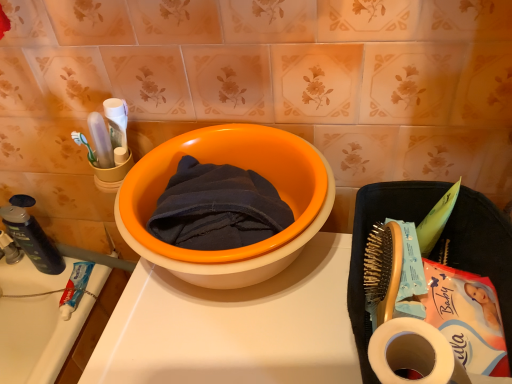
Question: Would you say dark blue cotton towel at center is inside or outside orange plastic basin at center?

Choices:
 (A) inside
 (B) outside

Answer: (A)

Question: Considering the positions of point (206, 192) and point (245, 142), is point (206, 192) closer or farther from the camera than point (245, 142)?

Choices:
 (A) closer
 (B) farther

Answer: (A)

Question: Estimate the real-world distances between objects in this image. Which object is farther from the dark blue cotton towel at center?

Choices:
 (A) dark blue plastic soap dispenser at left, which is counted as the 2th stationery, starting from the right
 (B) orange plastic basin at center
 (C) white matte toilet paper at lower right
 (D) white toothpaste tube at lower left, placed as the second stationery when sorted from left to right

Answer: (A)

Question: Considering the real-world distances, which object is farthest from the white toothpaste tube at lower left, the 1th stationery from the right?

Choices:
 (A) orange plastic basin at center
 (B) dark blue cotton towel at center
 (C) white matte toilet paper at lower right
 (D) dark blue plastic soap dispenser at left, which is the 1th stationery in left-to-right order

Answer: (C)